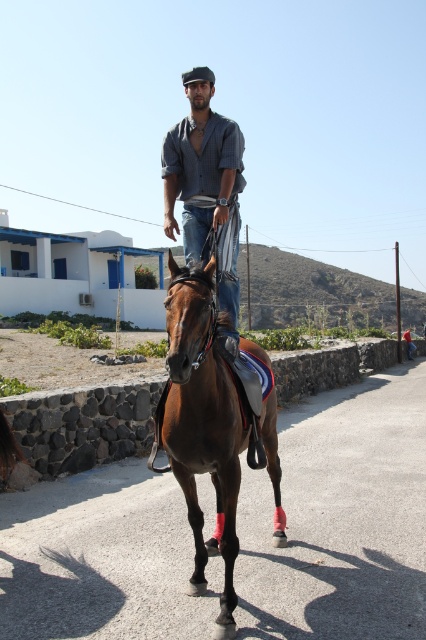
You are a photographer standing at the side of the road. You want to capture a photo where the glossy brown horse at center and the matte blue shirt at center are clearly visible. Based on their heights, which object should you focus on first to ensure it is in frame?

The glossy brown horse at center is shorter than the matte blue shirt at center, so you should focus on the matte blue shirt at center first to ensure it is in frame since it is taller and more likely to be visible from your perspective.

You are a photographer positioned at the origin point of the coordinate system. You want to take a photo of the glossy brown horse at center. What are the coordinates of the horse?

The coordinates of the glossy brown horse at center are at point (201, 422).